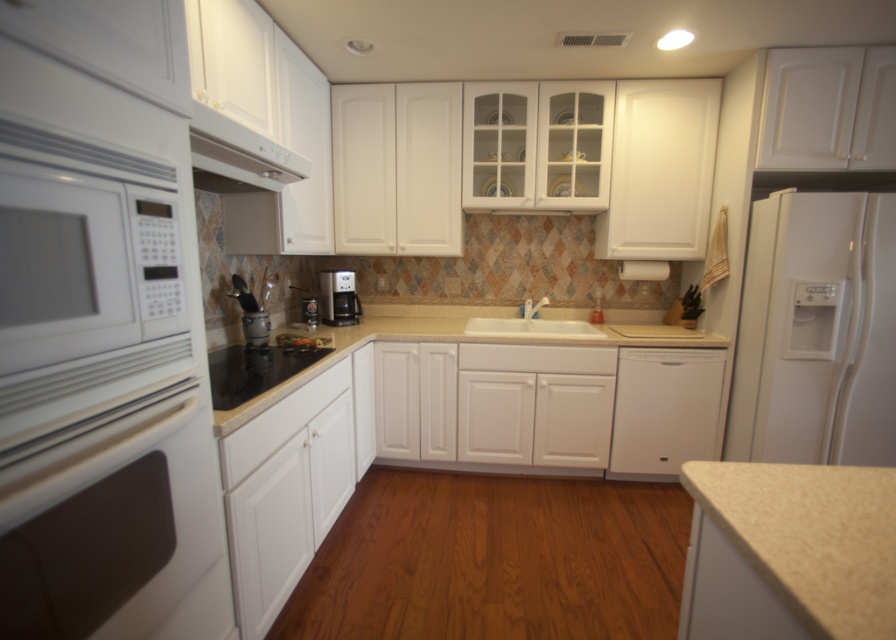
Based on the photo, you are a kitchen designer planning to install a new appliance. You have a white matte oven at left and a white glossy exhaust hood at upper center in the kitchen. Which appliance occupies a smaller horizontal space?

The white matte oven at left has a lesser width compared to the white glossy exhaust hood at upper center, so the white matte oven at left occupies a smaller horizontal space.

You are a chef preparing to move a large pot from the black glass stove at center to the white matte oven at left. Which direction should you move the pot to place it into the oven?

The white matte oven at left is to the right of the black glass stove at center, so you should move the pot to the right to place it into the oven.